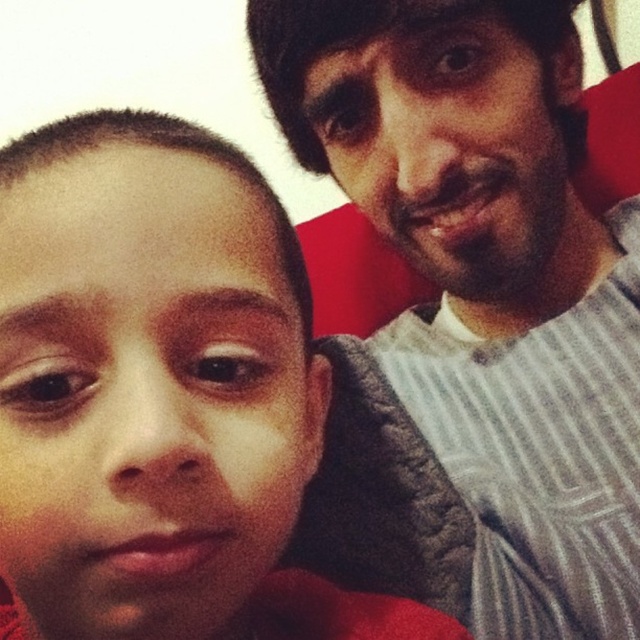
Does point (444, 218) come in front of point (150, 124)?

No, (444, 218) is behind (150, 124).

Does point (396, 10) come behind point (45, 296)?

Yes, it is behind point (45, 296).

At what (x,y) coordinates should I click in order to perform the action: click on gray striped shirt at upper right. Please return your answer as a coordinate pair (x, y). The image size is (640, 640). Looking at the image, I should click on (474, 314).